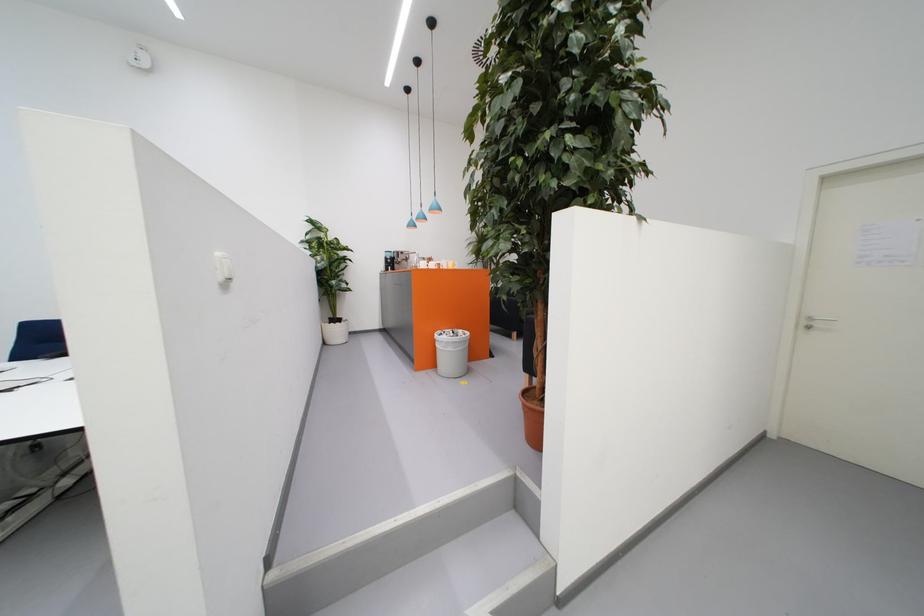
The height and width of the screenshot is (616, 924). I want to click on white coffee mug, so point(420,262).